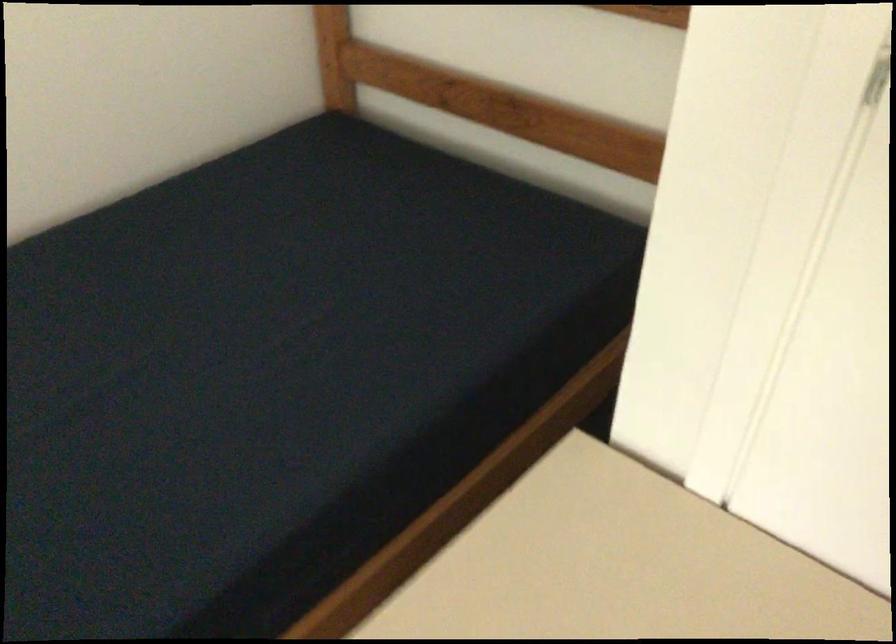
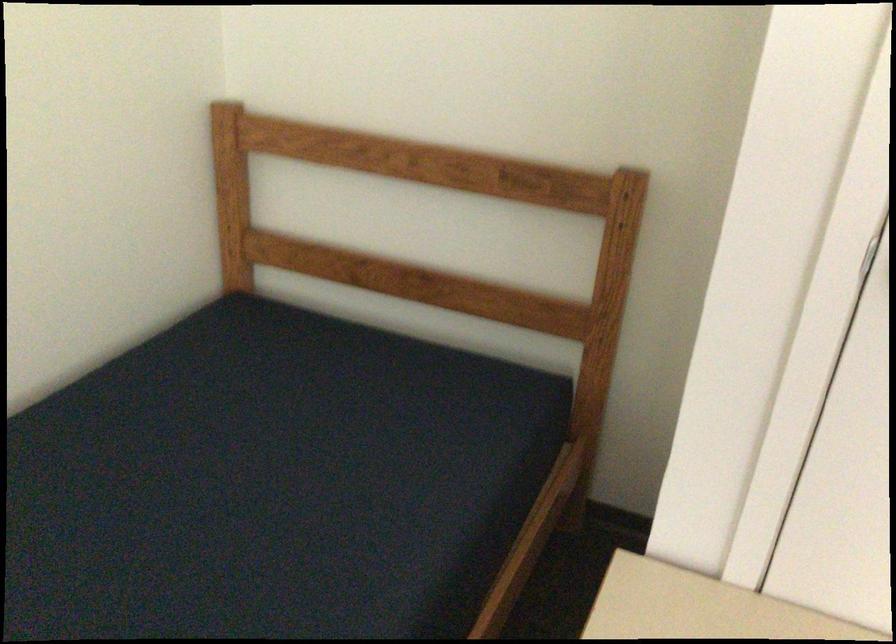
Where in the second image is the point corresponding to point 286,304 from the first image?

(273, 484)